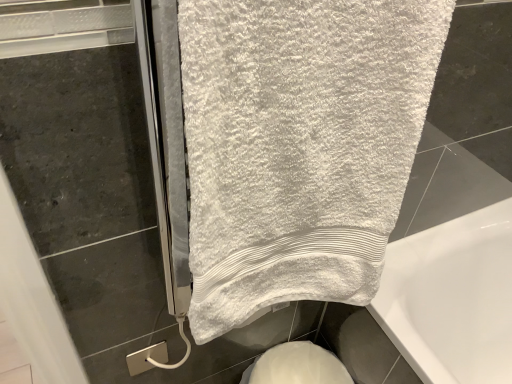
Question: Is white glossy bidet at lower center touching white soft towel at upper center?

Choices:
 (A) no
 (B) yes

Answer: (A)

Question: Is white glossy bidet at lower center facing towards white soft towel at upper center?

Choices:
 (A) yes
 (B) no

Answer: (B)

Question: From the image's perspective, does white glossy bidet at lower center appear lower than white soft towel at upper center?

Choices:
 (A) yes
 (B) no

Answer: (A)

Question: Considering the relative sizes of white glossy bidet at lower center and white soft towel at upper center in the image provided, is white glossy bidet at lower center smaller than white soft towel at upper center?

Choices:
 (A) yes
 (B) no

Answer: (A)

Question: Is white glossy bidet at lower center surrounding white soft towel at upper center?

Choices:
 (A) no
 (B) yes

Answer: (A)

Question: From a real-world perspective, is white glossy bidet at lower center located beneath white soft towel at upper center?

Choices:
 (A) yes
 (B) no

Answer: (A)

Question: Is white soft towel at upper center behind white glossy bidet at lower center?

Choices:
 (A) yes
 (B) no

Answer: (B)

Question: Is white soft towel at upper center thinner than white glossy bidet at lower center?

Choices:
 (A) no
 (B) yes

Answer: (A)

Question: Is white soft towel at upper center facing towards white glossy bidet at lower center?

Choices:
 (A) no
 (B) yes

Answer: (A)

Question: Is white soft towel at upper center positioned beyond the bounds of white glossy bidet at lower center?

Choices:
 (A) yes
 (B) no

Answer: (A)

Question: Considering the relative sizes of white soft towel at upper center and white glossy bidet at lower center in the image provided, is white soft towel at upper center bigger than white glossy bidet at lower center?

Choices:
 (A) yes
 (B) no

Answer: (A)

Question: Is white soft towel at upper center positioned before white glossy bidet at lower center?

Choices:
 (A) yes
 (B) no

Answer: (A)

Question: Is white soft towel at upper center to the left or to the right of white glossy bidet at lower center in the image?

Choices:
 (A) left
 (B) right

Answer: (A)